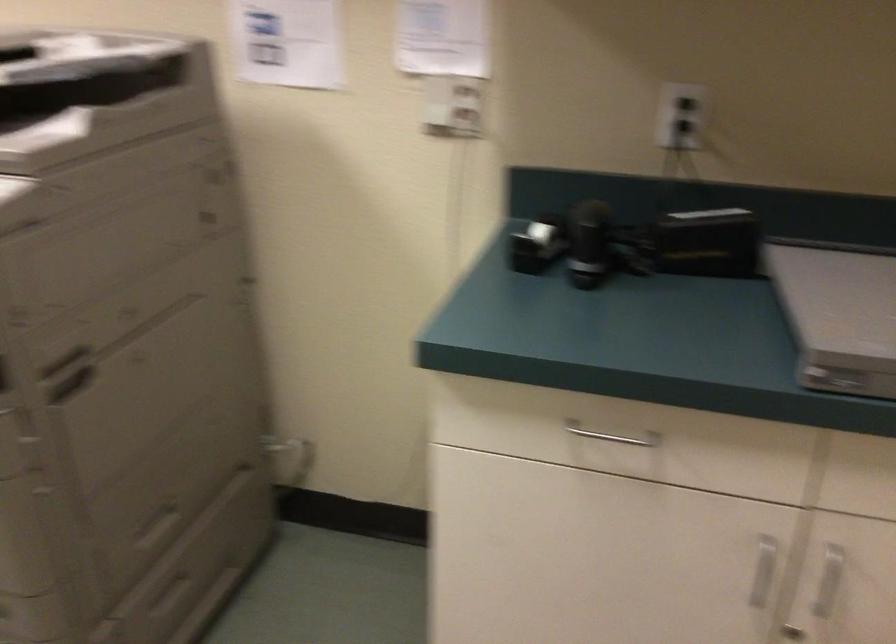
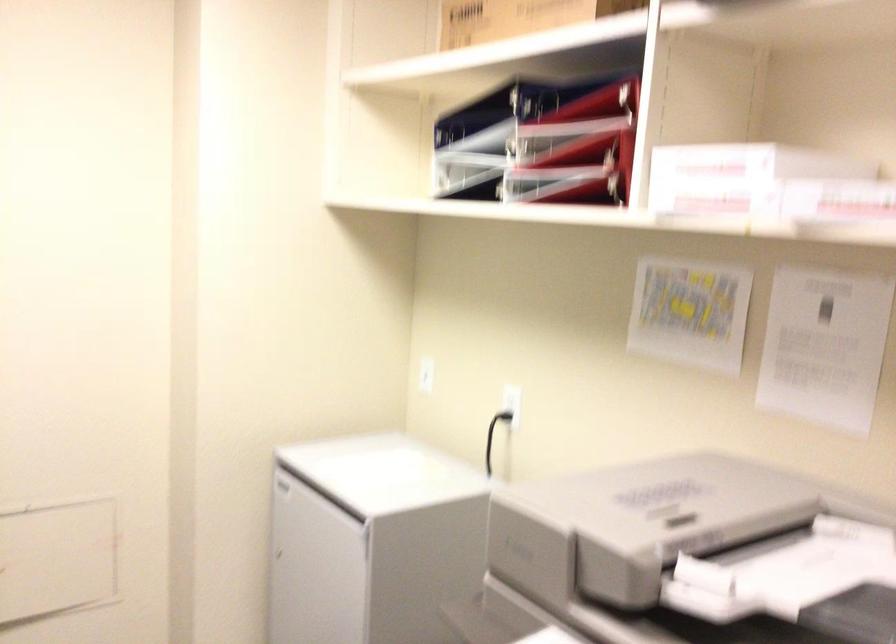
Question: Based on the continuous images, in which direction is the camera rotating? Reply with the corresponding letter.

Choices:
 (A) Left
 (B) Right
 (C) Up
 (D) Down

Answer: (A)